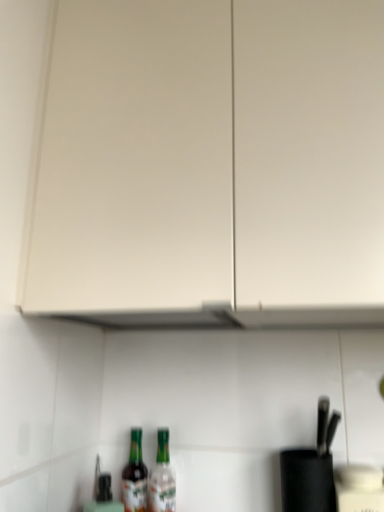
What do you see at coordinates (162, 478) in the screenshot? I see `translucent glass bottle at lower center, the first bottle in the right-to-left sequence` at bounding box center [162, 478].

In the scene shown: What is the approximate height of green glass bottle at lower center, which is the 1th bottle in left-to-right order?

green glass bottle at lower center, which is the 1th bottle in left-to-right order, is 24.74 centimeters tall.

This screenshot has width=384, height=512. Identify the location of translucent glass bottle at lower center, the first bottle in the right-to-left sequence. (162, 478).

Is the position of translucent glass bottle at lower center, which is the second bottle from left to right, less distant than that of white matte cabinet at upper center?

No, it is behind white matte cabinet at upper center.

From the image's perspective, is translucent glass bottle at lower center, the first bottle in the right-to-left sequence, on white matte cabinet at upper center?

No.

From a real-world perspective, is translucent glass bottle at lower center, which is the second bottle from left to right, located higher than white matte cabinet at upper center?

No, from a real-world perspective, translucent glass bottle at lower center, which is the second bottle from left to right, is not over white matte cabinet at upper center

From a real-world perspective, is green glass bottle at lower center, which is the 1th bottle in left-to-right order, positioned above or below translucent glass bottle at lower center, the first bottle in the right-to-left sequence?

From a real-world perspective, green glass bottle at lower center, which is the 1th bottle in left-to-right order, is physically below translucent glass bottle at lower center, the first bottle in the right-to-left sequence.

Can you confirm if green glass bottle at lower center, which is the 1th bottle in left-to-right order, is wider than translucent glass bottle at lower center, which is the second bottle from left to right?

Incorrect, the width of green glass bottle at lower center, which is the 1th bottle in left-to-right order, does not surpass that of translucent glass bottle at lower center, which is the second bottle from left to right.

Does point (127, 469) come farther from viewer compared to point (169, 509)?

Yes.

Is green glass bottle at lower center, the 2th bottle in the right-to-left sequence, in front of or behind translucent glass bottle at lower center, the first bottle in the right-to-left sequence, in the image?

green glass bottle at lower center, the 2th bottle in the right-to-left sequence, is behind translucent glass bottle at lower center, the first bottle in the right-to-left sequence.

Which of these two, green glass bottle at lower center, which is the 1th bottle in left-to-right order, or white matte cabinet at upper center, is bigger?

white matte cabinet at upper center is bigger.

How far apart are green glass bottle at lower center, which is the 1th bottle in left-to-right order, and white matte cabinet at upper center?

The distance of green glass bottle at lower center, which is the 1th bottle in left-to-right order, from white matte cabinet at upper center is 28.05 inches.

Where is `the 2nd bottle below when counting from the white matte cabinet at upper center (from the image's perspective)`? Image resolution: width=384 pixels, height=512 pixels. the 2nd bottle below when counting from the white matte cabinet at upper center (from the image's perspective) is located at coordinates (135, 477).

Is green glass bottle at lower center, which is the 1th bottle in left-to-right order, next to white matte cabinet at upper center?

green glass bottle at lower center, which is the 1th bottle in left-to-right order, is not next to white matte cabinet at upper center, and they're not touching.

Which object is more forward, white matte cabinet at upper center or green glass bottle at lower center, the 2th bottle in the right-to-left sequence?

white matte cabinet at upper center is more forward.

Which is in front, point (117, 141) or point (124, 500)?

Point (117, 141)

Looking at the image, does white matte cabinet at upper center seem bigger or smaller compared to green glass bottle at lower center, which is the 1th bottle in left-to-right order?

Clearly, white matte cabinet at upper center is larger in size than green glass bottle at lower center, which is the 1th bottle in left-to-right order.

In the image, is white matte cabinet at upper center on the left side or the right side of green glass bottle at lower center, the 2th bottle in the right-to-left sequence?

Based on their positions, white matte cabinet at upper center is located to the right of green glass bottle at lower center, the 2th bottle in the right-to-left sequence.

There is a white matte cabinet at upper center. At what (x,y) coordinates should I click in order to perform the action: click on the 1st bottle below it (from the image's perspective). Please return your answer as a coordinate pair (x, y). Looking at the image, I should click on (162, 478).

From the image's perspective, which one is positioned lower, white matte cabinet at upper center or translucent glass bottle at lower center, the first bottle in the right-to-left sequence?

translucent glass bottle at lower center, the first bottle in the right-to-left sequence, is shown below in the image.

Is white matte cabinet at upper center positioned with its back to translucent glass bottle at lower center, which is the second bottle from left to right?

No.

Is white matte cabinet at upper center positioned beyond the bounds of translucent glass bottle at lower center, the first bottle in the right-to-left sequence?

Yes, white matte cabinet at upper center is located beyond the bounds of translucent glass bottle at lower center, the first bottle in the right-to-left sequence.

From the image's perspective, is translucent glass bottle at lower center, which is the second bottle from left to right, positioned above or below green glass bottle at lower center, the 2th bottle in the right-to-left sequence?

Based on their image positions, translucent glass bottle at lower center, which is the second bottle from left to right, is located above green glass bottle at lower center, the 2th bottle in the right-to-left sequence.

Consider the image. Are translucent glass bottle at lower center, which is the second bottle from left to right, and green glass bottle at lower center, the 2th bottle in the right-to-left sequence, far apart?

Actually, translucent glass bottle at lower center, which is the second bottle from left to right, and green glass bottle at lower center, the 2th bottle in the right-to-left sequence, are a little close together.

How different are the orientations of translucent glass bottle at lower center, which is the second bottle from left to right, and green glass bottle at lower center, which is the 1th bottle in left-to-right order, in degrees?

5.62e-05 degrees.

Starting from the white matte cabinet at upper center, which bottle is the 1st one to the left? Please provide its 2D coordinates.

[(162, 478)]

This screenshot has height=512, width=384. Identify the location of bottle that appears below the translucent glass bottle at lower center, the first bottle in the right-to-left sequence (from the image's perspective). (135, 477).

Considering their positions, is translucent glass bottle at lower center, the first bottle in the right-to-left sequence, positioned further to white matte cabinet at upper center than green glass bottle at lower center, the 2th bottle in the right-to-left sequence?

Among the two, green glass bottle at lower center, the 2th bottle in the right-to-left sequence, is located further to white matte cabinet at upper center.

Which object lies further to the anchor point green glass bottle at lower center, which is the 1th bottle in left-to-right order, white matte cabinet at upper center or translucent glass bottle at lower center, the first bottle in the right-to-left sequence?

Based on the image, white matte cabinet at upper center appears to be further to green glass bottle at lower center, which is the 1th bottle in left-to-right order.

Consider the image. Looking at the image, which one is located closer to translucent glass bottle at lower center, the first bottle in the right-to-left sequence, white matte cabinet at upper center or green glass bottle at lower center, which is the 1th bottle in left-to-right order?

green glass bottle at lower center, which is the 1th bottle in left-to-right order, lies closer to translucent glass bottle at lower center, the first bottle in the right-to-left sequence, than the other object.

Which object lies nearer to the anchor point translucent glass bottle at lower center, which is the second bottle from left to right, green glass bottle at lower center, which is the 1th bottle in left-to-right order, or white matte cabinet at upper center?

green glass bottle at lower center, which is the 1th bottle in left-to-right order.

From the image, which object appears to be nearer to white matte cabinet at upper center, green glass bottle at lower center, the 2th bottle in the right-to-left sequence, or translucent glass bottle at lower center, which is the second bottle from left to right?

Among the two, translucent glass bottle at lower center, which is the second bottle from left to right, is located nearer to white matte cabinet at upper center.

Estimate the real-world distances between objects in this image. Which object is further from green glass bottle at lower center, which is the 1th bottle in left-to-right order, translucent glass bottle at lower center, which is the second bottle from left to right, or white matte cabinet at upper center?

The object further to green glass bottle at lower center, which is the 1th bottle in left-to-right order, is white matte cabinet at upper center.

You are a GUI agent. You are given a task and a screenshot of the screen. Output one action in this format:
    pyautogui.click(x=<x>, y=<y>)
    Task: Click on the bottle between white matte cabinet at upper center and green glass bottle at lower center, the 2th bottle in the right-to-left sequence, in the up-down direction
    The width and height of the screenshot is (384, 512).
    Given the screenshot: What is the action you would take?
    pyautogui.click(x=162, y=478)